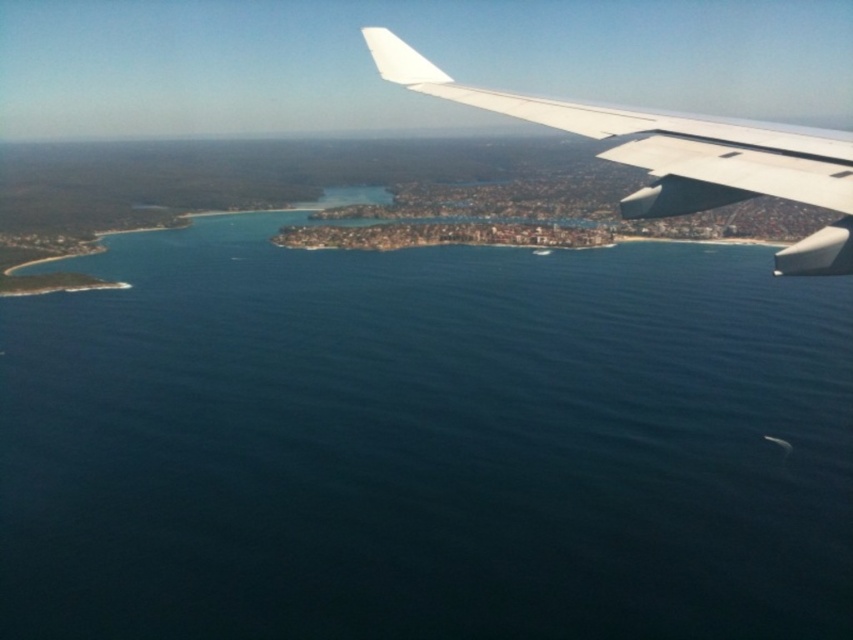
Can you confirm if deep blue water at center is shorter than white matte wing at upper right?

No.

Image resolution: width=853 pixels, height=640 pixels. What are the coordinates of `deep blue water at center` in the screenshot? It's located at (425, 444).

Image resolution: width=853 pixels, height=640 pixels. I want to click on deep blue water at center, so click(x=425, y=444).